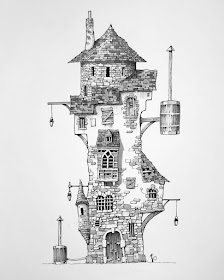
Image resolution: width=224 pixels, height=280 pixels. Identify the location of window. (107, 138).